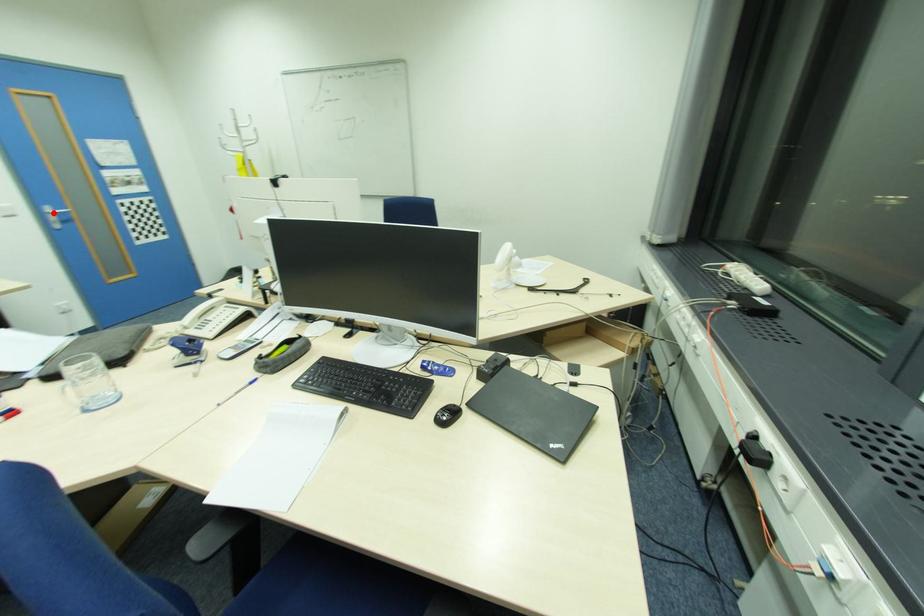
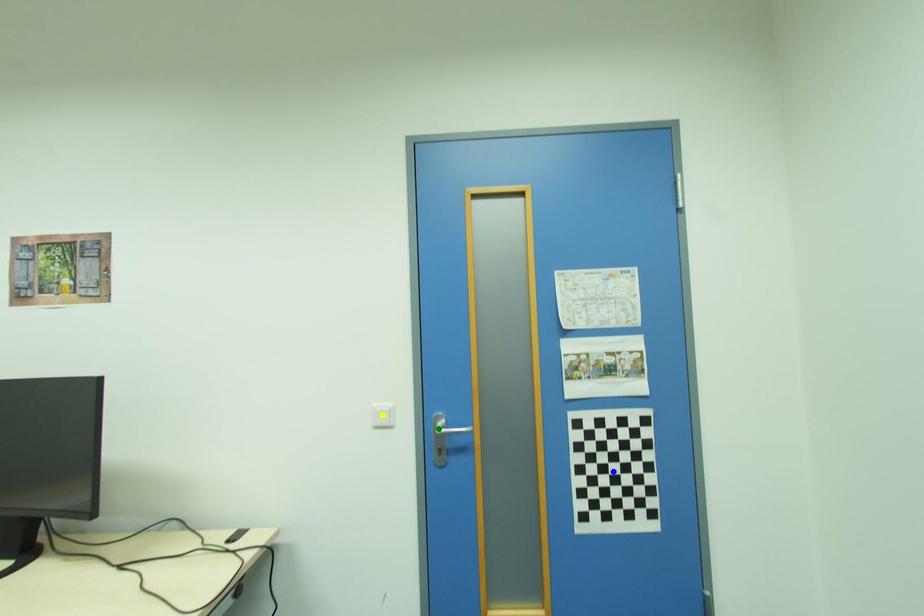
Question: I am providing you with two images of the same scene from different viewpoints. A red point is marked on the first image. You are given multiple points on the second image. Which mark in image 2 goes with the point in image 1?

Choices:
 (A) blue point
 (B) green point
 (C) yellow point

Answer: (B)